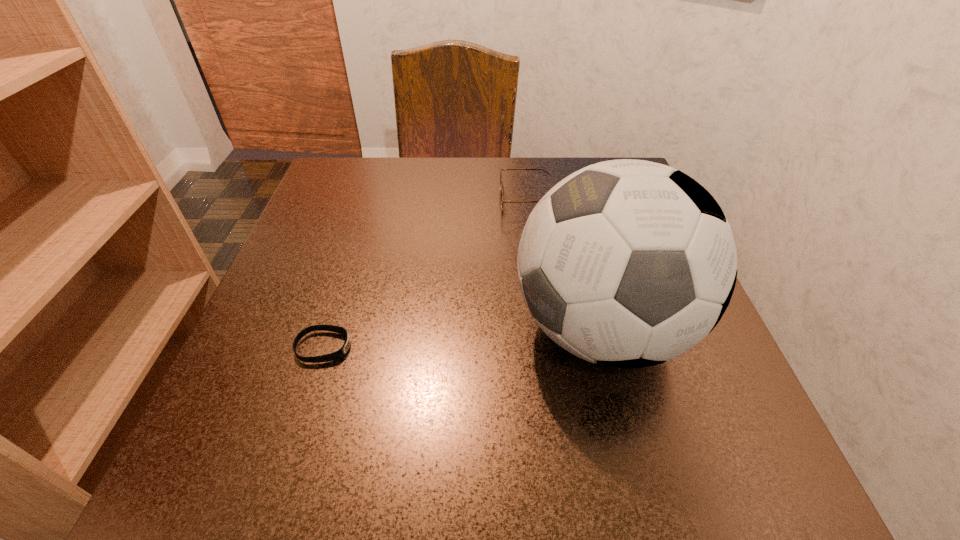
Identify the location of soccer ball. (627, 263).

At what (x,y) coordinates should I click in order to perform the action: click on the farthest object. Please return your answer as a coordinate pair (x, y). The width and height of the screenshot is (960, 540). Looking at the image, I should click on (501, 169).

You are a GUI agent. You are given a task and a screenshot of the screen. Output one action in this format:
    pyautogui.click(x=<x>, y=<y>)
    Task: Click on the spectacles
    The image size is (960, 540).
    Given the screenshot: What is the action you would take?
    pyautogui.click(x=501, y=169)

Where is `wristband`? The image size is (960, 540). wristband is located at coordinates (341, 352).

I want to click on the leftmost object, so click(341, 352).

Identify the location of vacant position located 0.270m on the main logo of the tallest object. (347, 329).

In order to click on vacant space located on the main logo of the tallest object in this screenshot , I will do `click(347, 329)`.

Find the location of a particular element. The height and width of the screenshot is (540, 960). free region located 0.110m on the main logo of the tallest object is located at coordinates (444, 329).

What are the coordinates of `vacant space located 0.140m at the front view of the second tallest object` in the screenshot? It's located at (438, 200).

Where is `free point located 0.170m at the front view of the second tallest object`? The height and width of the screenshot is (540, 960). free point located 0.170m at the front view of the second tallest object is located at coordinates click(x=424, y=200).